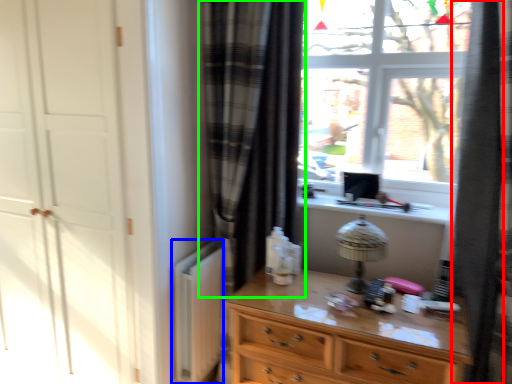
Question: Which object is positioned farthest from shower curtain (highlighted by a red box)? Select from radiator (highlighted by a blue box) and curtain (highlighted by a green box).

Choices:
 (A) radiator
 (B) curtain

Answer: (A)